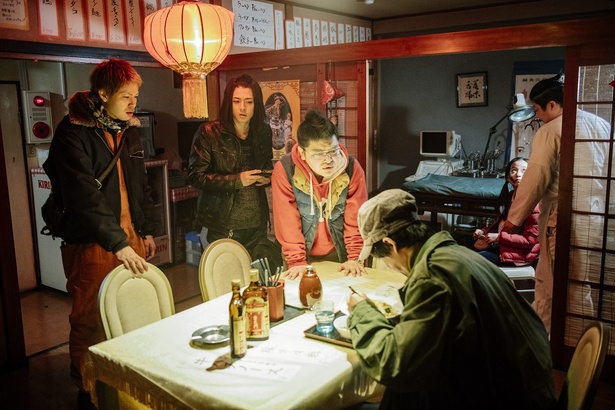
Where is `glass of water`? The image size is (615, 410). glass of water is located at coordinates (326, 325).